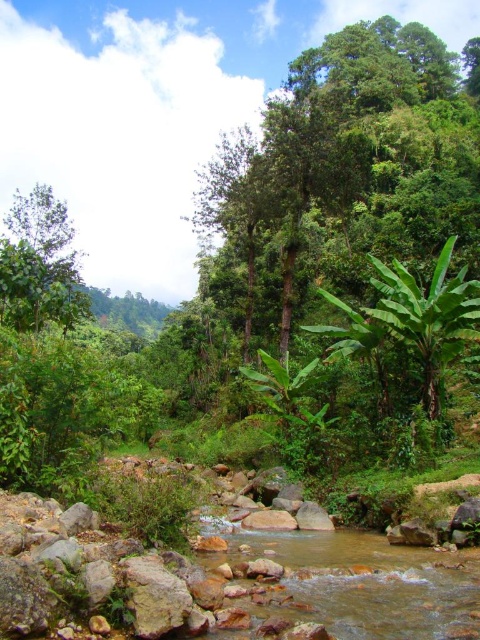
Between green leafy tree at center and green leafy tree at left, which one appears on the right side from the viewer's perspective?

green leafy tree at center

Where is `green leafy tree at center`? The height and width of the screenshot is (640, 480). green leafy tree at center is located at coordinates (348, 168).